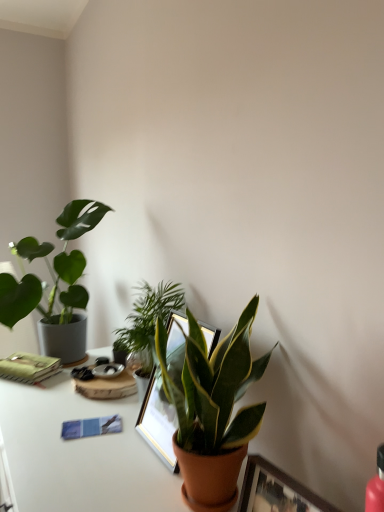
Question: In the image, is green glossy plant at center, acting as the second houseplant starting from the right, on the left side or the right side of green matte plant at left, positioned as the third houseplant in right-to-left order?

Choices:
 (A) left
 (B) right

Answer: (B)

Question: Looking at their shapes, would you say green glossy plant at center, marked as the second houseplant in a left-to-right arrangement, is wider or thinner than green matte plant at left, the 3th houseplant from the front?

Choices:
 (A) wide
 (B) thin

Answer: (B)

Question: Based on their relative distances, which object is nearer to the white glossy table at lower center?

Choices:
 (A) blue paper journal at lower left
 (B) green matte notebook at left
 (C) wooden picture frame at center
 (D) green matte plant at left, the 1th houseplant in the back-to-front sequence
 (E) green glossy plant at center, acting as the second houseplant starting from the right

Answer: (A)

Question: Estimate the real-world distances between objects in this image. Which object is closer to the wooden picture frame at center?

Choices:
 (A) green matte plant at center, the 1th houseplant positioned from the front
 (B) blue paper journal at lower left
 (C) green matte notebook at left
 (D) white glossy table at lower center
 (E) green glossy plant at center, the 2th houseplant when ordered from back to front

Answer: (A)